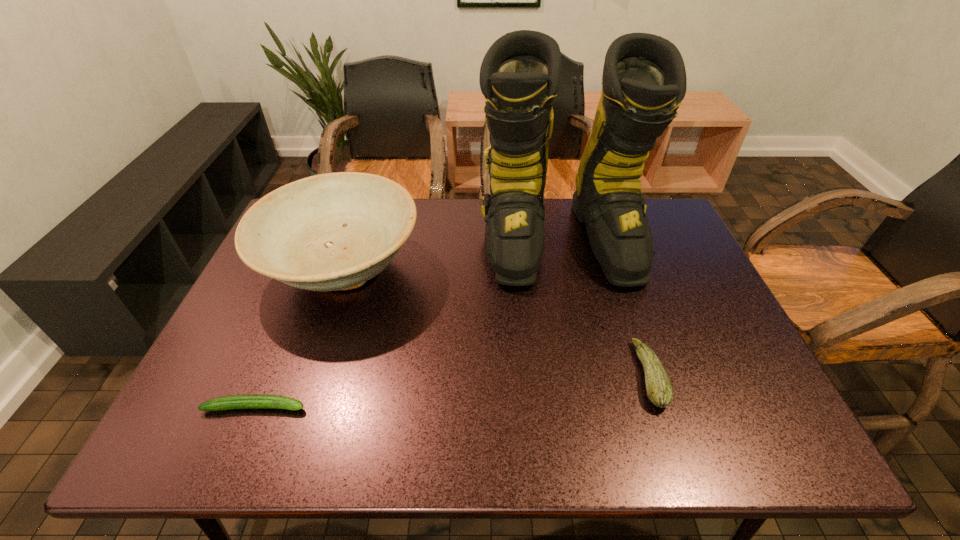
The height and width of the screenshot is (540, 960). I want to click on ski boots, so click(x=644, y=80).

You are a GUI agent. You are given a task and a screenshot of the screen. Output one action in this format:
    pyautogui.click(x=<x>, y=<y>)
    Task: Click on the dish
    The width and height of the screenshot is (960, 540).
    Given the screenshot: What is the action you would take?
    pyautogui.click(x=328, y=232)

I want to click on the third tallest object, so click(x=659, y=389).

The image size is (960, 540). Find the location of `the taller zucchini`. the taller zucchini is located at coordinates (659, 389).

Find the location of `the shortest object`. the shortest object is located at coordinates tap(249, 401).

Where is `the shorter zucchini`? Image resolution: width=960 pixels, height=540 pixels. the shorter zucchini is located at coordinates tap(249, 401).

At what (x,y) coordinates should I click in order to perform the action: click on vacant region located 0.400m on the front of the ski boots. Please return your answer as a coordinate pair (x, y). The width and height of the screenshot is (960, 540). Looking at the image, I should click on (602, 434).

The image size is (960, 540). Find the location of `vacant area situated 0.160m on the right of the second tallest object`. vacant area situated 0.160m on the right of the second tallest object is located at coordinates (479, 271).

This screenshot has width=960, height=540. Find the location of `free space located at the stem end of the taller zucchini`. free space located at the stem end of the taller zucchini is located at coordinates (516, 375).

You are a GUI agent. You are given a task and a screenshot of the screen. Output one action in this format:
    pyautogui.click(x=<x>, y=<y>)
    Task: Click on the blank space located at the stem end of the taller zucchini
    Image resolution: width=960 pixels, height=540 pixels.
    Given the screenshot: What is the action you would take?
    [561, 375]